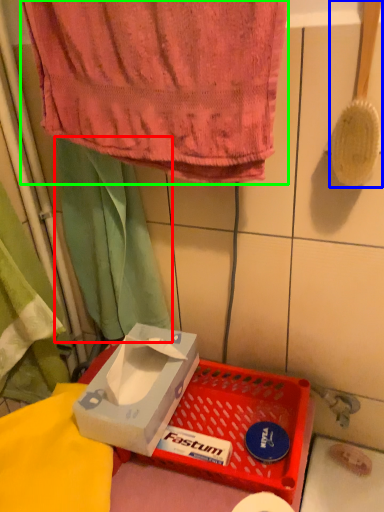
Question: Considering the real-world distances, which object is farthest from curtain (highlighted by a red box)? brush (highlighted by a blue box) or towel (highlighted by a green box)?

Choices:
 (A) brush
 (B) towel

Answer: (A)